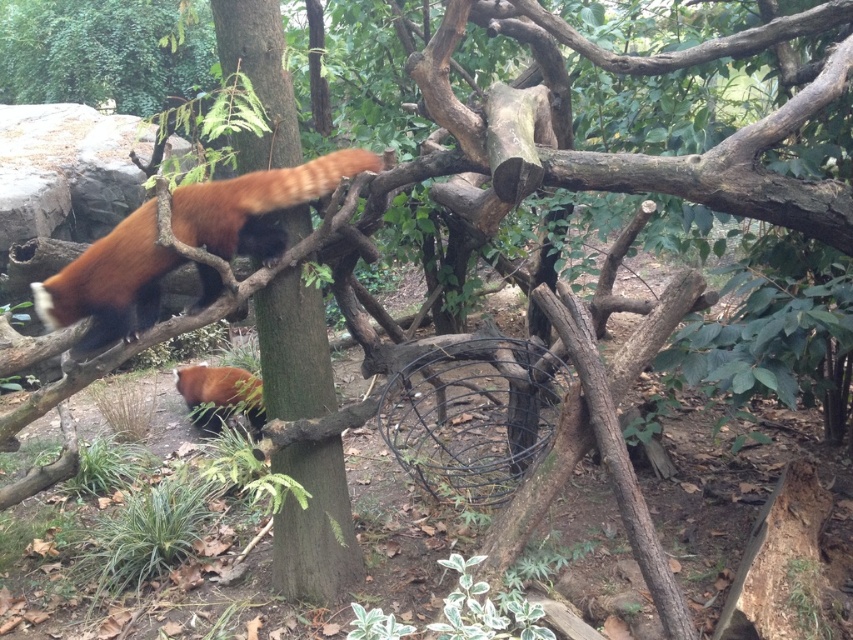
Question: Which is nearer to the fluffy reddish-brown fur at lower center?

Choices:
 (A) green rough bark tree trunk at center
 (B) fuzzy reddish-brown fur at upper left

Answer: (A)

Question: Is fuzzy reddish-brown fur at upper left thinner than fluffy reddish-brown fur at lower center?

Choices:
 (A) no
 (B) yes

Answer: (A)

Question: Estimate the real-world distances between objects in this image. Which object is farther from the fuzzy reddish-brown fur at upper left?

Choices:
 (A) fluffy reddish-brown fur at lower center
 (B) green rough bark tree trunk at center

Answer: (A)

Question: Where is fuzzy reddish-brown fur at upper left located in relation to fluffy reddish-brown fur at lower center in the image?

Choices:
 (A) above
 (B) below

Answer: (A)

Question: Which point is farther from the camera taking this photo?

Choices:
 (A) (236, 392)
 (B) (332, 182)

Answer: (A)

Question: Does green rough bark tree trunk at center have a lesser width compared to fluffy reddish-brown fur at lower center?

Choices:
 (A) no
 (B) yes

Answer: (B)